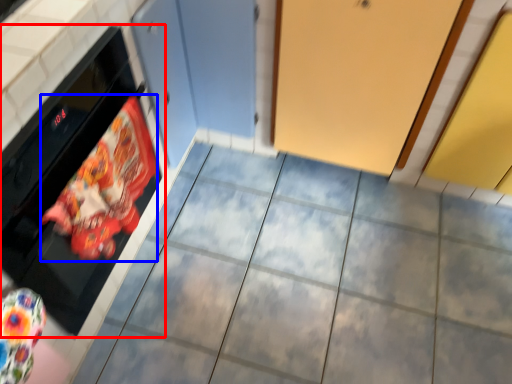
Question: Which object is further to the camera taking this photo, oven (highlighted by a red box) or material (highlighted by a blue box)?

Choices:
 (A) oven
 (B) material

Answer: (B)